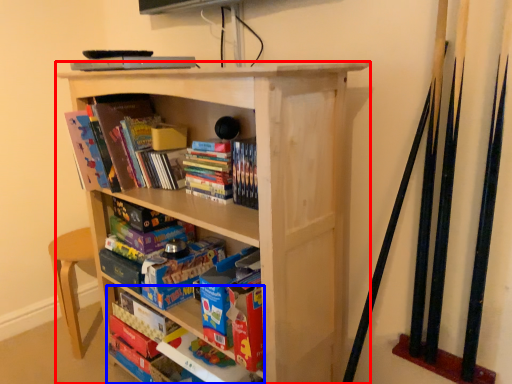
Question: Which of the following is the closest to the observer, bookcase (highlighted by a red box) or book (highlighted by a blue box)?

Choices:
 (A) bookcase
 (B) book

Answer: (A)